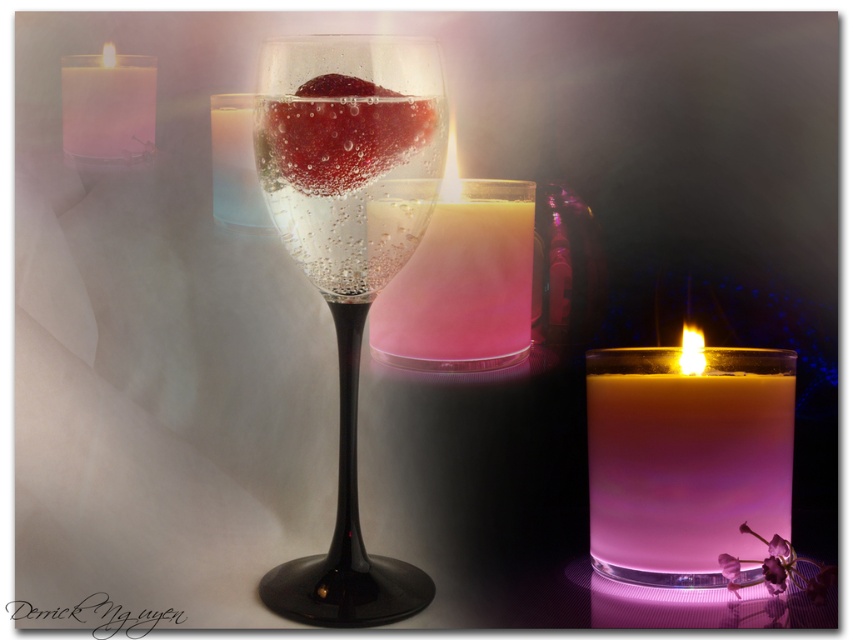
You are planning to place a decorative item on a small table that can only hold one object. You have the clear glass wine glass at center and the translucent pink candle at center. Based on their sizes, which object should you choose to ensure it fits better on the table?

The clear glass wine glass at center has a larger size compared to the translucent pink candle at center, so the translucent pink candle at center would fit better on the small table.

You are planning to place a decorative item between the translucent pink candle at center and the white wax candle at upper left. Based on their positions, which candle should the item be closer to if you want it to be on the left side of the path between them?

The item should be closer to the white wax candle at upper left because the translucent pink candle at center is positioned to the right of the white wax candle at upper left, so the left side of the path between them is near the white wax candle at upper left.

You are standing in front of the romantic evening setting described. You want to place a small decoration between the two points, point (688,403) and point (227,122). Which point should the decoration be closer to so it appears centered from your view?

The decoration should be closer to point (227,122) because point (688,403) is in front of point (227,122), so placing it closer to the back point will create a centered appearance.